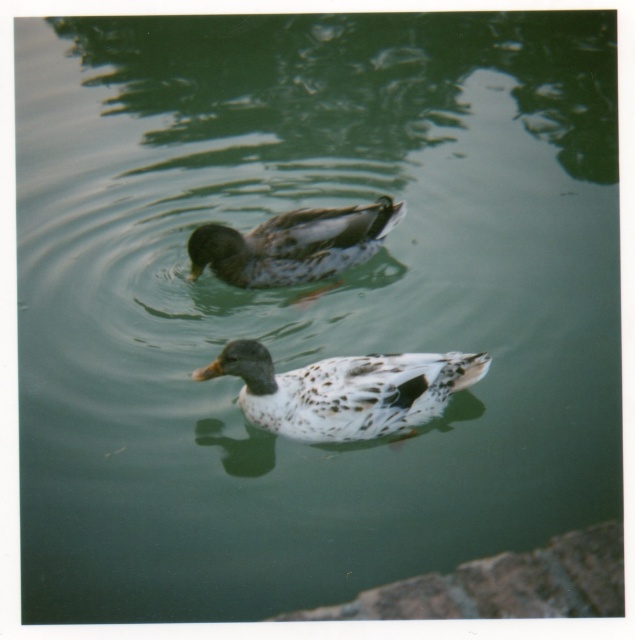
Looking at this image, you are observing two ducks in a pond. The speckled feathered duck at center and the speckled brown duck at center. Which duck is located to the right of the other?

The speckled feathered duck at center is positioned on the right side of the speckled brown duck at center.

You are observing two ducks in a pond. The speckled feathered duck at center has white with black spots and the speckled brown duck at center is further back and to the left. Which duck takes up less space in the image?

The speckled feathered duck at center occupies less space than the speckled brown duck at center, so the speckled feathered duck at center takes up less space.